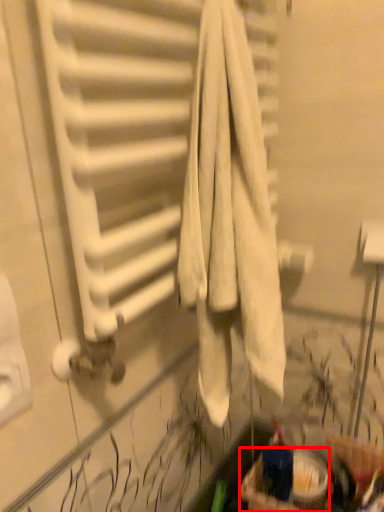
Question: Observing the image, what is the correct spatial positioning of basket (annotated by the red box) in reference to radiator?

Choices:
 (A) right
 (B) left

Answer: (A)